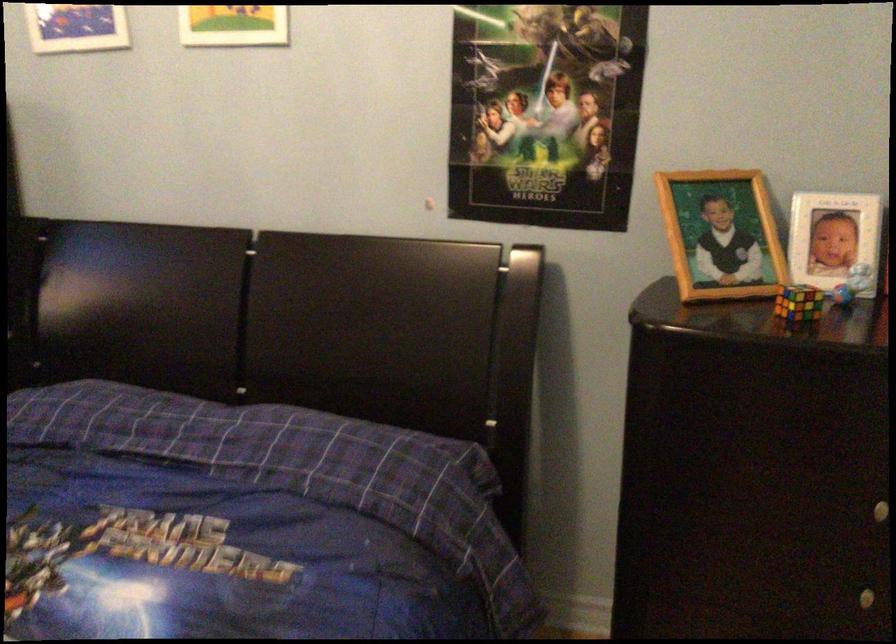
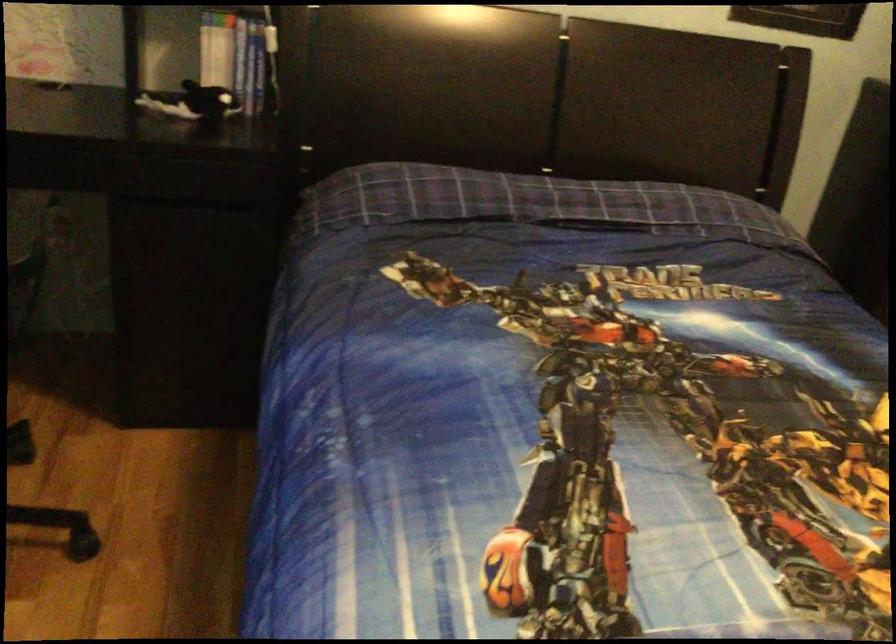
Question: The images are taken continuously from a first-person perspective. In which direction are you moving?

Choices:
 (A) Left
 (B) Right
 (C) Forward
 (D) Backward

Answer: (A)